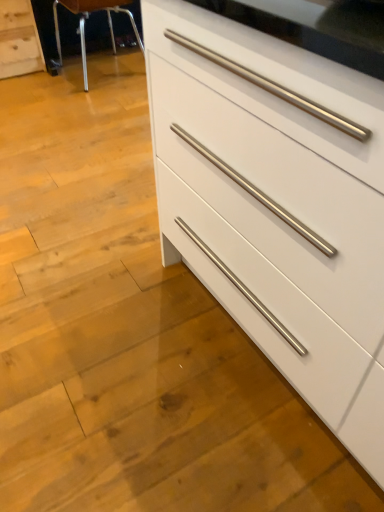
Question: Which direction should I rotate to face white glossy chest of drawers at center, the first chest of drawers in the right-to-left sequence, — up or down?

Choices:
 (A) up
 (B) down

Answer: (A)

Question: Considering the relative positions of white glossy chest of drawers at center, the 2th chest of drawers positioned from the left, and metallic silver bar stool at upper left in the image provided, is white glossy chest of drawers at center, the 2th chest of drawers positioned from the left, behind metallic silver bar stool at upper left?

Choices:
 (A) no
 (B) yes

Answer: (A)

Question: Can you confirm if white glossy chest of drawers at center, the 2th chest of drawers positioned from the left, is positioned to the right of metallic silver bar stool at upper left?

Choices:
 (A) yes
 (B) no

Answer: (A)

Question: Is white glossy chest of drawers at center, the 1th chest of drawers from the front, oriented towards metallic silver bar stool at upper left?

Choices:
 (A) yes
 (B) no

Answer: (B)

Question: Is white glossy chest of drawers at center, the 2th chest of drawers positioned from the left, outside of metallic silver bar stool at upper left?

Choices:
 (A) no
 (B) yes

Answer: (B)

Question: Considering the relative sizes of white glossy chest of drawers at center, the first chest of drawers in the right-to-left sequence, and metallic silver bar stool at upper left in the image provided, is white glossy chest of drawers at center, the first chest of drawers in the right-to-left sequence, bigger than metallic silver bar stool at upper left?

Choices:
 (A) no
 (B) yes

Answer: (B)

Question: Does white glossy chest of drawers at center, the first chest of drawers in the right-to-left sequence, have a greater height compared to metallic silver bar stool at upper left?

Choices:
 (A) yes
 (B) no

Answer: (A)

Question: From a real-world perspective, is white matte chest of drawers at lower left, arranged as the 1th chest of drawers when viewed from the left, over white glossy chest of drawers at center, the first chest of drawers from the bottom?

Choices:
 (A) yes
 (B) no

Answer: (B)

Question: From the image's perspective, is white matte chest of drawers at lower left, which ranks as the second chest of drawers in bottom-to-top order, above white glossy chest of drawers at center, the 1th chest of drawers from the front?

Choices:
 (A) yes
 (B) no

Answer: (A)

Question: Is white matte chest of drawers at lower left, which is the second chest of drawers in right-to-left order, not inside white glossy chest of drawers at center, the second chest of drawers when ordered from back to front?

Choices:
 (A) yes
 (B) no

Answer: (A)

Question: Does white matte chest of drawers at lower left, the first chest of drawers from the top, appear on the left side of white glossy chest of drawers at center, the first chest of drawers from the bottom?

Choices:
 (A) yes
 (B) no

Answer: (A)

Question: Does white matte chest of drawers at lower left, which ranks as the second chest of drawers in bottom-to-top order, appear on the right side of white glossy chest of drawers at center, which is the 2th chest of drawers from top to bottom?

Choices:
 (A) no
 (B) yes

Answer: (A)

Question: Can you confirm if white matte chest of drawers at lower left, which ranks as the second chest of drawers in bottom-to-top order, is bigger than white glossy chest of drawers at center, the second chest of drawers when ordered from back to front?

Choices:
 (A) yes
 (B) no

Answer: (B)

Question: Is white matte chest of drawers at lower left, the 2th chest of drawers viewed from the front, to the left of metallic silver bar stool at upper left from the viewer's perspective?

Choices:
 (A) yes
 (B) no

Answer: (A)